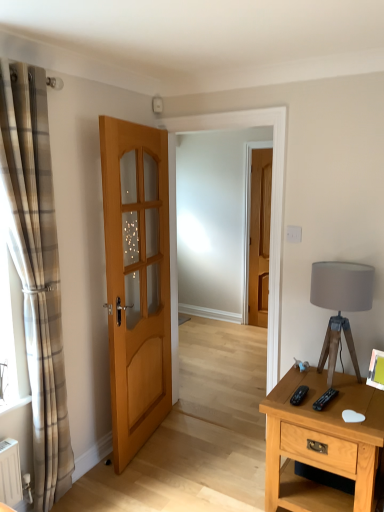
Question: From a real-world perspective, relative to light brown wooden door at center, the 1th door viewed from the front, is matte gray fabric lampshade at right vertically above or below?

Choices:
 (A) below
 (B) above

Answer: (A)

Question: Considering the positions of matte gray fabric lampshade at right and light brown wooden door at center, the second door from the right, in the image, is matte gray fabric lampshade at right taller or shorter than light brown wooden door at center, the second door from the right,?

Choices:
 (A) short
 (B) tall

Answer: (A)

Question: Estimate the real-world distances between objects in this image. Which object is farther from the light brown wooden nightstand at right?

Choices:
 (A) plaid fabric curtain at left
 (B) matte gray fabric lampshade at right
 (C) matte wooden door at center, the first door when ordered from back to front
 (D) light brown wooden door at center, acting as the second door starting from the back

Answer: (C)

Question: Based on their relative distances, which object is nearer to the matte wooden door at center, which ranks as the 2th door in front-to-back order?

Choices:
 (A) plaid fabric curtain at left
 (B) matte gray fabric lampshade at right
 (C) light brown wooden door at center, the 1th door viewed from the front
 (D) light brown wooden nightstand at right

Answer: (C)